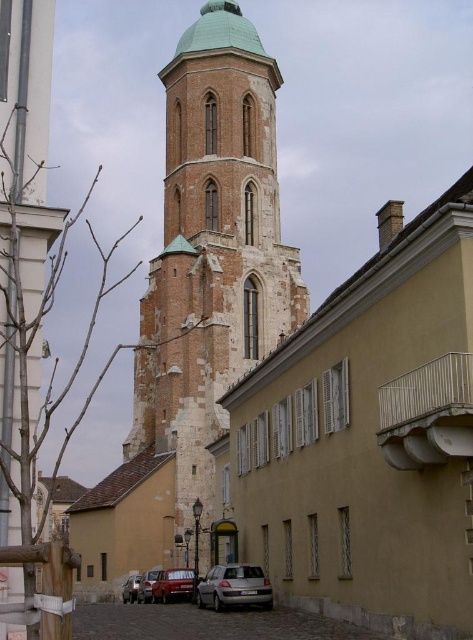
In the scene shown: You are standing on the street looking at the church tower and the beige building. There are two points marked on the image. The first point is at coordinates point (210, 493) and the second point is at point (226, 564). Which point is closer to you?

Point (226, 564) is closer to you because the description states that point (210, 493) is behind point (226, 564).

You are a delivery driver who needs to park your truck, which is 4.5 meters long, in the space between the matte red car at center and the shiny silver car at lower left. Can your truck fit in that space?

The space between the matte red car at center and the shiny silver car at lower left is 4.10 meters. Since your truck is 4.5 meters long, it is 0.4 meters too long to fit in the available space.